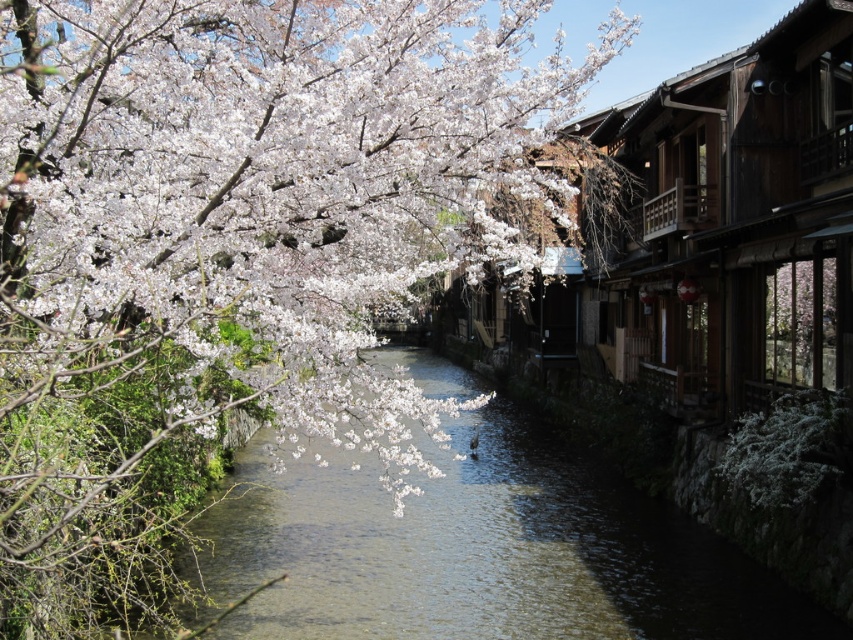
Question: Which point appears closest to the camera in this image?

Choices:
 (A) (67, 104)
 (B) (711, 632)

Answer: (A)

Question: Is white matte flower at upper left bigger than clear water at center?

Choices:
 (A) yes
 (B) no

Answer: (A)

Question: Is white matte flower at upper left bigger than clear water at center?

Choices:
 (A) yes
 (B) no

Answer: (A)

Question: Can you confirm if white matte flower at upper left is positioned above clear water at center?

Choices:
 (A) yes
 (B) no

Answer: (A)

Question: Which point is farther from the camera taking this photo?

Choices:
 (A) (465, 118)
 (B) (492, 470)

Answer: (B)

Question: Which of the following is the closest to the observer?

Choices:
 (A) (523, 179)
 (B) (315, 545)

Answer: (A)